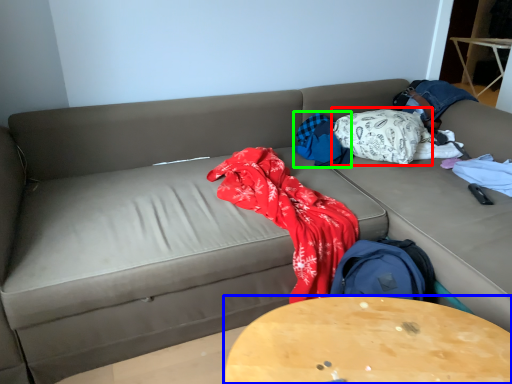
Question: Based on their relative distances, which object is farther from blanket (highlighted by a red box)? Choose from table (highlighted by a blue box) and blanket (highlighted by a green box).

Choices:
 (A) table
 (B) blanket

Answer: (A)